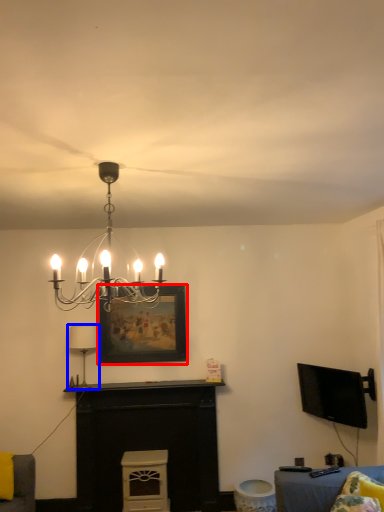
Question: Which object appears farthest to the camera in this image, picture frame (highlighted by a red box) or lamp (highlighted by a blue box)?

Choices:
 (A) picture frame
 (B) lamp

Answer: (A)